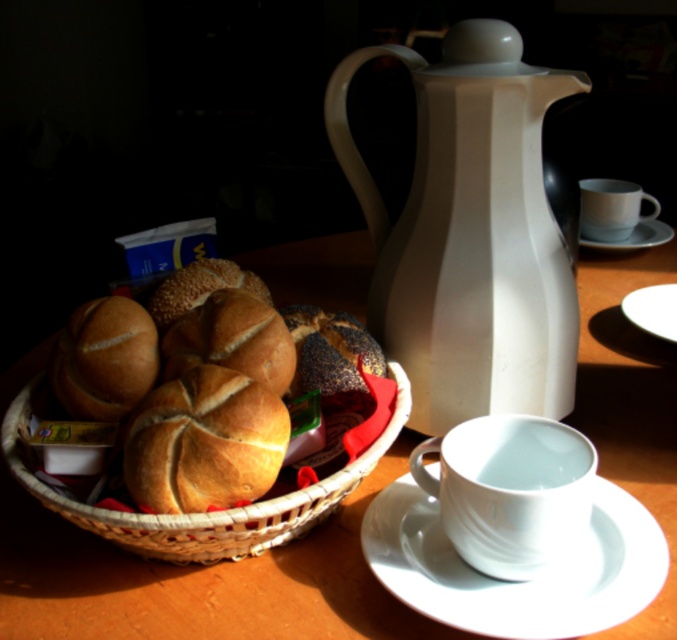
Question: Which point is closer to the camera taking this photo?

Choices:
 (A) (475, 384)
 (B) (416, 518)

Answer: (B)

Question: Does golden brown bread at center have a larger size compared to dark brown textured bread at center?

Choices:
 (A) yes
 (B) no

Answer: (A)

Question: Which point is farther to the camera?

Choices:
 (A) (640, 314)
 (B) (353, 376)
 (C) (162, 296)

Answer: (A)

Question: Which object is positioned farthest from the golden brown crusty bread at center?

Choices:
 (A) white ceramic saucer at lower right
 (B) woven brown basket at center left
 (C) dark brown textured bread at center
 (D) white glossy jug at center

Answer: (A)

Question: Is white glossy teacup at lower center closer to camera compared to matte brown bread at left?

Choices:
 (A) yes
 (B) no

Answer: (A)

Question: Does matte white table at center lie behind slightly golden matte bread at center?

Choices:
 (A) no
 (B) yes

Answer: (A)